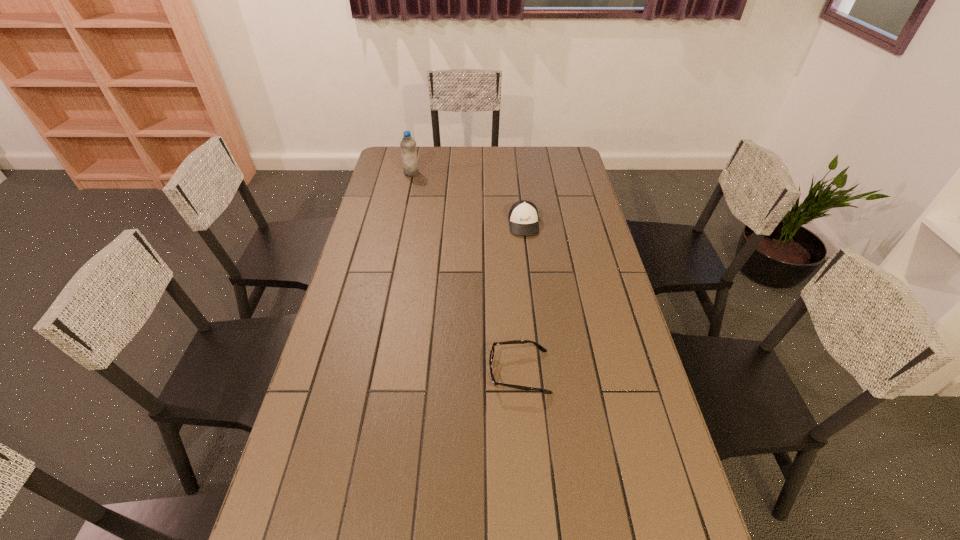
Identify the location of free space located on the front-facing side of the nearest object. (461, 372).

The width and height of the screenshot is (960, 540). What are the coordinates of `object positioned at the far edge` in the screenshot? It's located at (408, 145).

Find the location of `object situated at the left edge`. object situated at the left edge is located at coordinates (408, 145).

Find the location of `object that is positioned at the far left corner`. object that is positioned at the far left corner is located at coordinates (408, 145).

What are the coordinates of `vacant area at the far edge of the desktop` in the screenshot? It's located at click(509, 155).

This screenshot has height=540, width=960. In order to click on free space at the left edge of the desktop in this screenshot , I will do `click(343, 319)`.

Where is `vacant space at the right edge of the desktop`? vacant space at the right edge of the desktop is located at coordinates (564, 174).

You are a GUI agent. You are given a task and a screenshot of the screen. Output one action in this format:
    pyautogui.click(x=<x>, y=<y>)
    Task: Click on the vacant space at the far left corner
    The image size is (960, 540).
    Given the screenshot: What is the action you would take?
    pyautogui.click(x=400, y=164)

This screenshot has height=540, width=960. In the image, there is a desktop. Find the location of `free space at the far right corner`. free space at the far right corner is located at coordinates (556, 155).

I want to click on unoccupied area between the spectacles and the farthest object, so pyautogui.click(x=466, y=273).